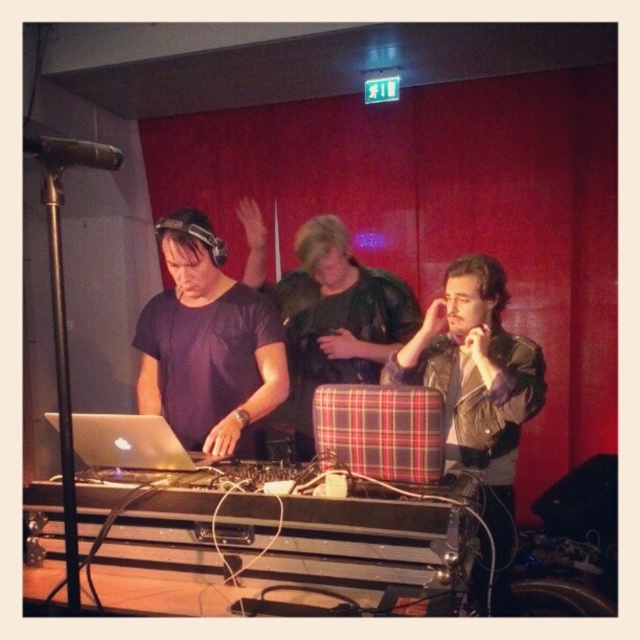
You are a photographer setting up for a live music event. You need to position your camera so that both the leather jacket at center and the black matte microphone at upper left are in frame. Which object should you focus on first to ensure both are visible?

The leather jacket at center is much taller than the black matte microphone at upper left, so you should focus on the taller leather jacket at center first to ensure both are in frame.

You are organizing a small event and need to place a decorative stand between the leather jacket at center and the black matte microphone at upper left. Which object should the stand be closer to if it needs to be near the larger item?

The stand should be closer to the leather jacket at center because it is larger in size than the black matte microphone at upper left.

You are a stagehand who needs to move a 1 meter long microphone stand between the leather jacket at center and the silver metallic laptop at left. Can the microphone stand fit through the space between them?

The distance between the leather jacket at center and the silver metallic laptop at left is 84.03 centimeters. Since the microphone stand is 1 meter long, which is longer than the available space, it cannot fit through the space between them.